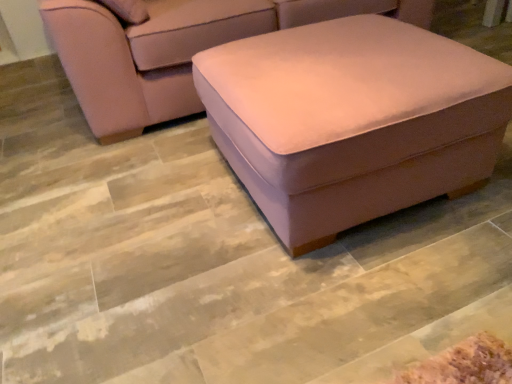
Question: Is suede-like pink ottoman at center touching suede-like beige ottoman at center?

Choices:
 (A) no
 (B) yes

Answer: (A)

Question: Is suede-like pink ottoman at center positioned behind suede-like beige ottoman at center?

Choices:
 (A) yes
 (B) no

Answer: (B)

Question: Considering the relative sizes of suede-like pink ottoman at center and suede-like beige ottoman at center in the image provided, is suede-like pink ottoman at center wider than suede-like beige ottoman at center?

Choices:
 (A) no
 (B) yes

Answer: (A)

Question: Is suede-like pink ottoman at center positioned before suede-like beige ottoman at center?

Choices:
 (A) no
 (B) yes

Answer: (B)

Question: Is suede-like pink ottoman at center facing towards suede-like beige ottoman at center?

Choices:
 (A) yes
 (B) no

Answer: (B)

Question: From the image's perspective, does suede-like pink ottoman at center appear lower than suede-like beige ottoman at center?

Choices:
 (A) yes
 (B) no

Answer: (A)

Question: Is suede-like beige ottoman at center far from suede-like pink ottoman at center?

Choices:
 (A) no
 (B) yes

Answer: (A)

Question: Is the position of suede-like beige ottoman at center less distant than that of suede-like pink ottoman at center?

Choices:
 (A) no
 (B) yes

Answer: (A)

Question: Is suede-like beige ottoman at center not within suede-like pink ottoman at center?

Choices:
 (A) yes
 (B) no

Answer: (A)

Question: Is suede-like beige ottoman at center bigger than suede-like pink ottoman at center?

Choices:
 (A) no
 (B) yes

Answer: (B)

Question: Can you confirm if suede-like beige ottoman at center is smaller than suede-like pink ottoman at center?

Choices:
 (A) no
 (B) yes

Answer: (A)

Question: Does suede-like beige ottoman at center lie behind suede-like pink ottoman at center?

Choices:
 (A) no
 (B) yes

Answer: (B)

Question: From the image's perspective, is suede-like pink ottoman at center located above or below suede-like beige ottoman at center?

Choices:
 (A) below
 (B) above

Answer: (A)